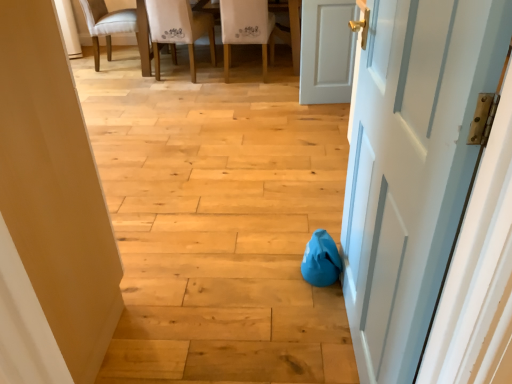
Where is `vacant region below white painted wood door at right, the second door from the right (from a real-world perspective)`? This screenshot has height=384, width=512. vacant region below white painted wood door at right, the second door from the right (from a real-world perspective) is located at coordinates (349, 335).